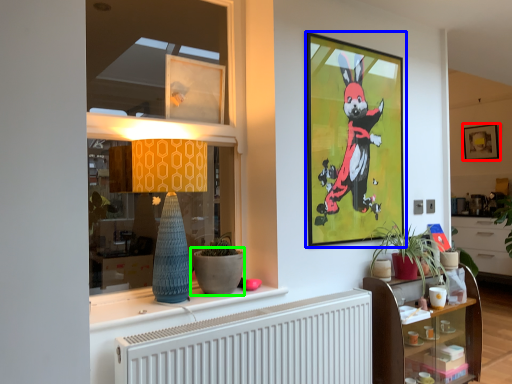
Question: Considering the real-world distances, which object is closest to picture frame (highlighted by a red box)? picture frame (highlighted by a blue box) or flowerpot (highlighted by a green box).

Choices:
 (A) picture frame
 (B) flowerpot

Answer: (A)